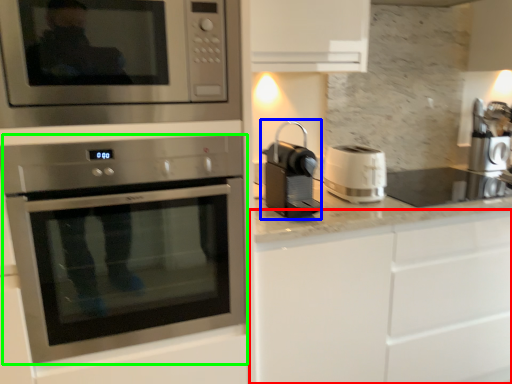
Question: Estimate the real-world distances between objects in this image. Which object is farther from cabinetry (highlighted by a red box), coffee machine (highlighted by a blue box) or oven (highlighted by a green box)?

Choices:
 (A) coffee machine
 (B) oven

Answer: (B)